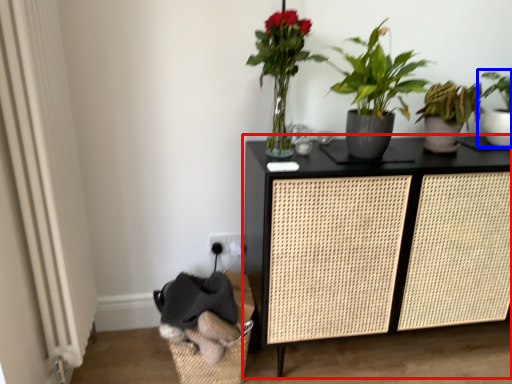
Question: Which object is further to the camera taking this photo, furniture (highlighted by a red box) or houseplant (highlighted by a blue box)?

Choices:
 (A) furniture
 (B) houseplant

Answer: (B)